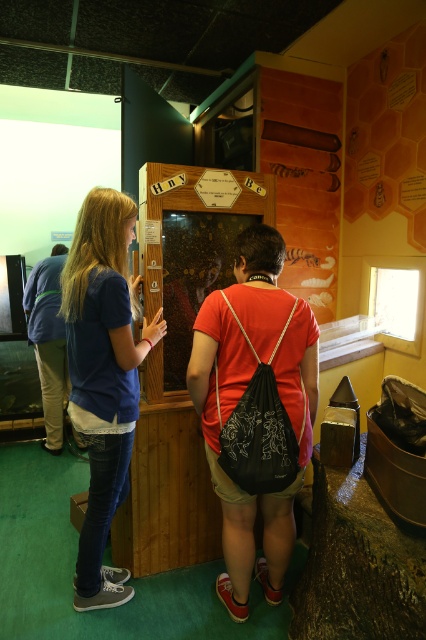
Which is more to the left, blue denim jeans at left or wooden honeycomb display at center?

From the viewer's perspective, blue denim jeans at left appears more on the left side.

Does blue denim jeans at left have a larger size compared to wooden honeycomb display at center?

Yes, blue denim jeans at left is bigger than wooden honeycomb display at center.

At what (x,y) coordinates should I click in order to perform the action: click on blue denim jeans at left. Please return your answer as a coordinate pair (x, y). Looking at the image, I should click on (103, 376).